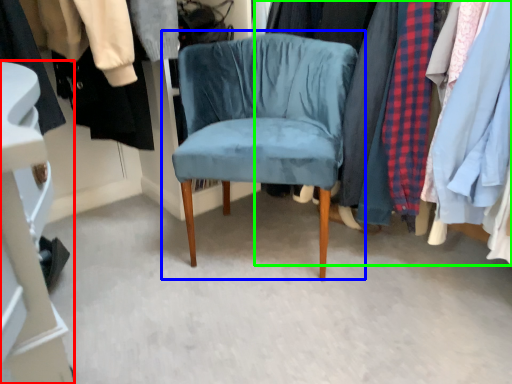
Question: Which object is the closest to the closet (highlighted by a red box)? Choose among these: chair (highlighted by a blue box) or closet (highlighted by a green box).

Choices:
 (A) chair
 (B) closet

Answer: (A)